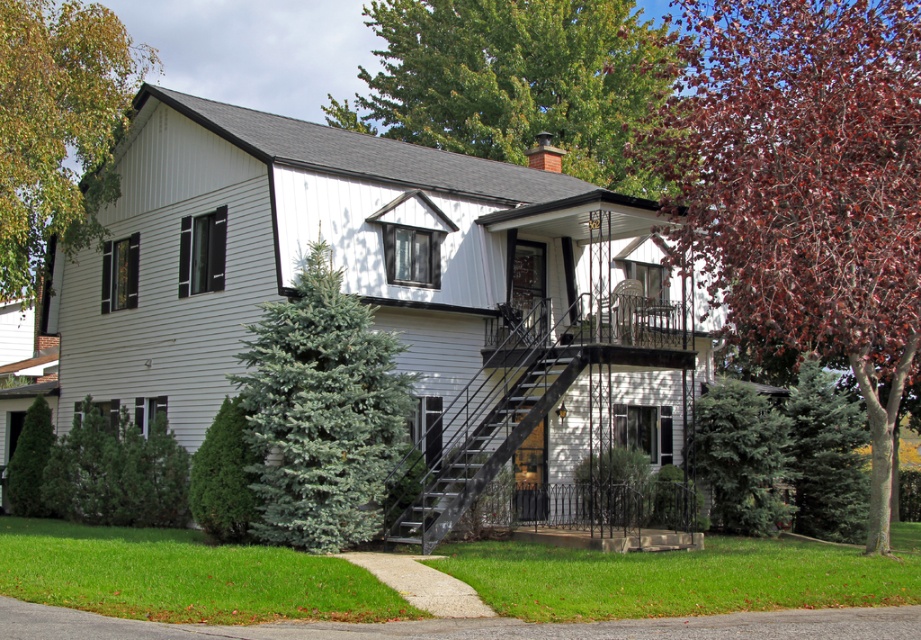
Question: Is reddish-brown bark tree at upper right bigger than green leafy tree at upper left?

Choices:
 (A) no
 (B) yes

Answer: (A)

Question: Which point is closer to the camera?

Choices:
 (A) (841, 259)
 (B) (631, 172)
 (C) (327, 525)
 (D) (834, 401)

Answer: (A)

Question: Which point appears farthest from the camera in this image?

Choices:
 (A) (600, 115)
 (B) (22, 451)
 (C) (27, 16)
 (D) (819, 497)

Answer: (A)

Question: From the image, what is the correct spatial relationship of green needle-like at center in relation to green textured evergreen tree at center?

Choices:
 (A) right
 (B) left

Answer: (B)

Question: Does green needle-like at center lie behind green textured bush at lower left?

Choices:
 (A) yes
 (B) no

Answer: (B)

Question: Which of the following is the closest to the observer?

Choices:
 (A) reddish-brown bark tree at upper right
 (B) black metal staircase at center

Answer: (A)